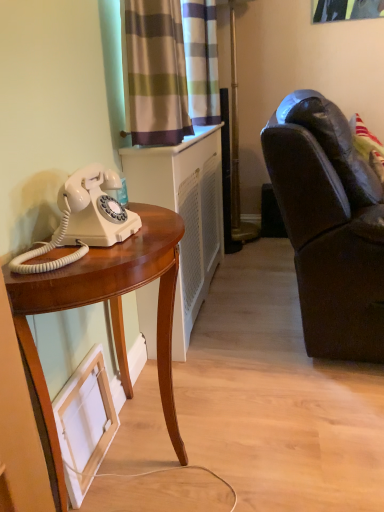
Locate an element on the screen. This screenshot has height=512, width=384. spots to the right of mahogany wood desk at left is located at coordinates (269, 439).